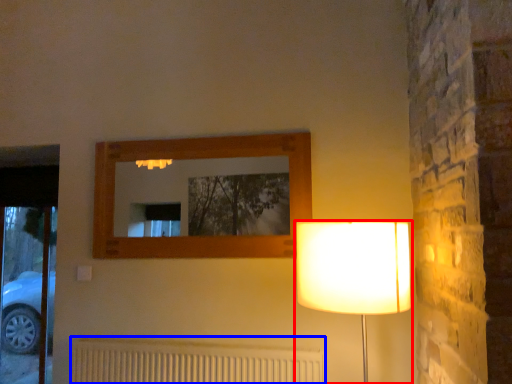
Question: Which object is closer to the camera taking this photo, lamp (highlighted by a red box) or radiator (highlighted by a blue box)?

Choices:
 (A) lamp
 (B) radiator

Answer: (A)